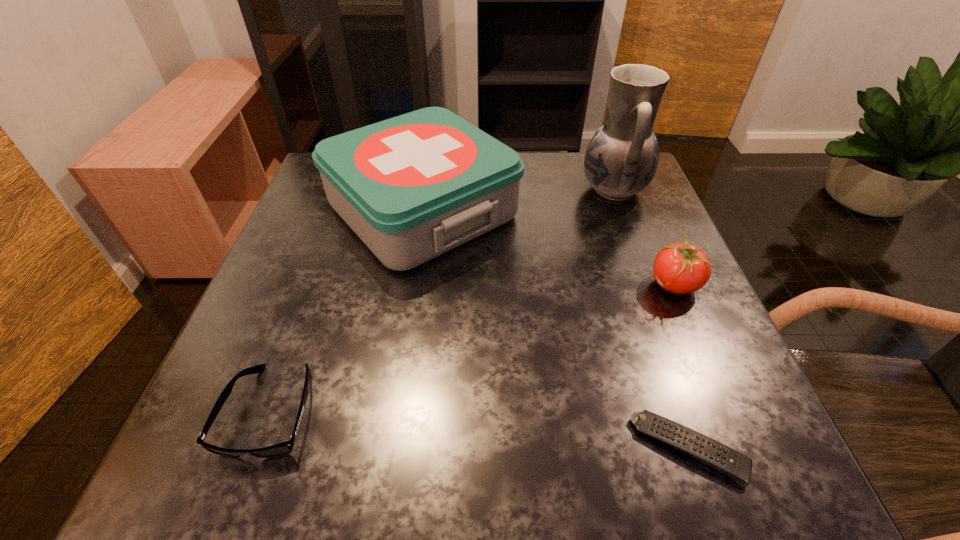
Find the location of a particular element. This screenshot has height=540, width=960. pitcher is located at coordinates (621, 159).

Image resolution: width=960 pixels, height=540 pixels. What are the coordinates of `the first-aid kit` in the screenshot? It's located at (412, 187).

Image resolution: width=960 pixels, height=540 pixels. What are the coordinates of `the third tallest object` in the screenshot? It's located at (681, 268).

At what (x,y) coordinates should I click in order to perform the action: click on sunglasses. Please return your answer as a coordinate pair (x, y). This screenshot has width=960, height=540. Looking at the image, I should click on (284, 448).

Identify the location of the shortest object. (726, 460).

Identify the location of vacant space located 0.290m on the front-facing side of the pitcher. The width and height of the screenshot is (960, 540). (460, 190).

Locate an element on the screen. Image resolution: width=960 pixels, height=540 pixels. vacant region located on the front-facing side of the pitcher is located at coordinates (522, 190).

Find the location of a particular element. This screenshot has height=540, width=960. vacant space located 0.330m on the front-facing side of the pitcher is located at coordinates (443, 190).

What are the coordinates of `vacant space located on the front of the second tallest object` in the screenshot? It's located at (386, 447).

Identify the location of vacant space located 0.080m on the left of the tomato. pyautogui.click(x=606, y=285).